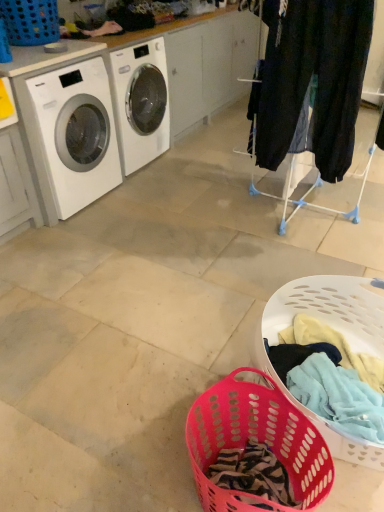
Question: From the image's perspective, is pink plastic laundry basket at lower center, the second basket positioned from the back, located above dark blue jeans at right?

Choices:
 (A) yes
 (B) no

Answer: (B)

Question: Can you confirm if pink plastic laundry basket at lower center, arranged as the third basket when viewed from the left, is taller than dark blue jeans at right?

Choices:
 (A) yes
 (B) no

Answer: (B)

Question: Can you confirm if pink plastic laundry basket at lower center, positioned as the second basket in bottom-to-top order, is thinner than dark blue jeans at right?

Choices:
 (A) yes
 (B) no

Answer: (B)

Question: Is pink plastic laundry basket at lower center, the second basket positioned from the back, shorter than dark blue jeans at right?

Choices:
 (A) no
 (B) yes

Answer: (B)

Question: In terms of width, does pink plastic laundry basket at lower center, which ranks as the 2th basket in top-to-bottom order, look wider or thinner when compared to dark blue jeans at right?

Choices:
 (A) thin
 (B) wide

Answer: (B)

Question: Is pink plastic laundry basket at lower center, the second basket positioned from the back, in front of or behind dark blue jeans at right in the image?

Choices:
 (A) behind
 (B) front

Answer: (B)

Question: Do you think pink plastic laundry basket at lower center, arranged as the third basket when viewed from the left, is within dark blue jeans at right, or outside of it?

Choices:
 (A) outside
 (B) inside

Answer: (A)

Question: Based on their positions, is pink plastic laundry basket at lower center, arranged as the third basket when viewed from the left, located to the left or right of dark blue jeans at right?

Choices:
 (A) right
 (B) left

Answer: (B)

Question: From the image's perspective, is blue plastic laundry basket at upper left, the 1th basket when ordered from top to bottom, positioned above or below dark blue jeans at right?

Choices:
 (A) below
 (B) above

Answer: (B)

Question: Do you think blue plastic laundry basket at upper left, the 1th basket when ordered from top to bottom, is within dark blue jeans at right, or outside of it?

Choices:
 (A) inside
 (B) outside

Answer: (B)

Question: From a real-world perspective, is blue plastic laundry basket at upper left, which is the third basket from bottom to top, positioned above or below dark blue jeans at right?

Choices:
 (A) below
 (B) above

Answer: (B)

Question: In terms of width, does blue plastic laundry basket at upper left, the third basket viewed from the right, look wider or thinner when compared to dark blue jeans at right?

Choices:
 (A) wide
 (B) thin

Answer: (A)

Question: Is white glossy washing machine at left spatially inside pink plastic laundry basket at lower center, which ranks as the 2th basket in top-to-bottom order, or outside of it?

Choices:
 (A) inside
 (B) outside

Answer: (B)

Question: From their relative heights in the image, would you say white glossy washing machine at left is taller or shorter than pink plastic laundry basket at lower center, positioned as the second basket in bottom-to-top order?

Choices:
 (A) tall
 (B) short

Answer: (A)